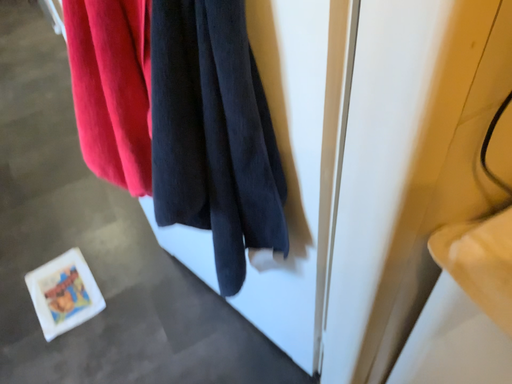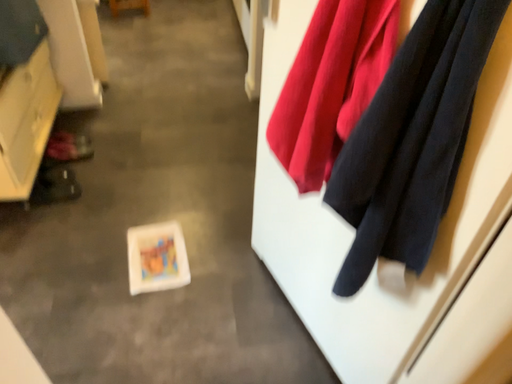
Question: How did the camera likely rotate when shooting the video?

Choices:
 (A) rotated downward
 (B) rotated upward

Answer: (B)